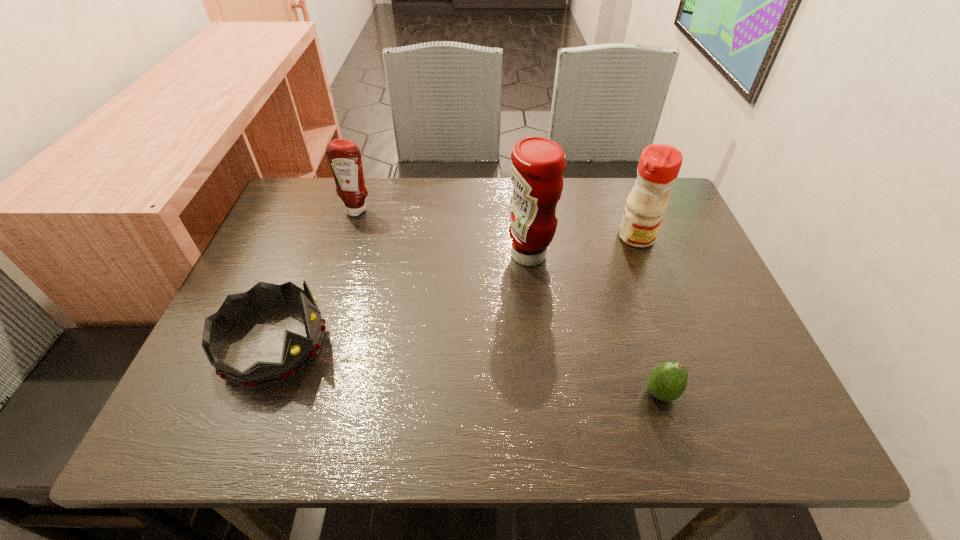
Image resolution: width=960 pixels, height=540 pixels. What are the coordinates of `free space located 0.060m at the front of the tiara with jewels` in the screenshot? It's located at (355, 344).

Find the location of `vacant space located on the right of the shortest object`. vacant space located on the right of the shortest object is located at coordinates (746, 393).

Identify the location of object positioned at the near edge. The height and width of the screenshot is (540, 960). (667, 381).

Find the location of a particular element. object that is at the left edge is located at coordinates (298, 351).

You are a GUI agent. You are given a task and a screenshot of the screen. Output one action in this format:
    pyautogui.click(x=<x>, y=<y>)
    Task: Click on the object present at the right edge
    Image resolution: width=960 pixels, height=540 pixels.
    Given the screenshot: What is the action you would take?
    pyautogui.click(x=659, y=165)

You are a GUI agent. You are given a task and a screenshot of the screen. Output one action in this format:
    pyautogui.click(x=<x>, y=<y>)
    Task: Click on the object located in the far right corner section of the desktop
    The width and height of the screenshot is (960, 540).
    Given the screenshot: What is the action you would take?
    pyautogui.click(x=659, y=165)

Locate an element on the screen. vacant space at the far edge of the desktop is located at coordinates (585, 189).

The image size is (960, 540). In the image, there is a desktop. Identify the location of vacant region at the near edge. (618, 429).

This screenshot has width=960, height=540. I want to click on free region at the left edge of the desktop, so click(267, 321).

Locate an element on the screen. free region at the right edge of the desktop is located at coordinates (675, 306).